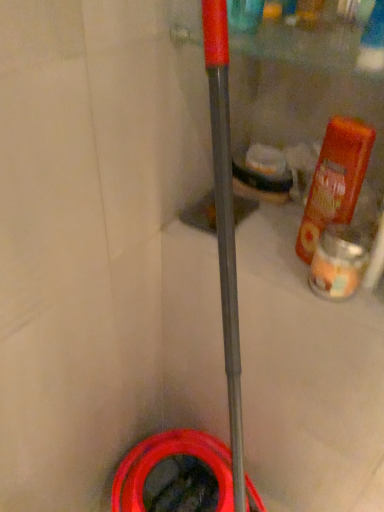
Question: Are rubber/matte garden hose at lower center and orange matte bottle at right far apart?

Choices:
 (A) yes
 (B) no

Answer: (B)

Question: From a real-world perspective, is rubber/matte garden hose at lower center physically above orange matte bottle at right?

Choices:
 (A) no
 (B) yes

Answer: (A)

Question: Can you confirm if rubber/matte garden hose at lower center is bigger than orange matte bottle at right?

Choices:
 (A) no
 (B) yes

Answer: (B)

Question: Can you see rubber/matte garden hose at lower center touching orange matte bottle at right?

Choices:
 (A) no
 (B) yes

Answer: (A)

Question: Does rubber/matte garden hose at lower center have a smaller size compared to orange matte bottle at right?

Choices:
 (A) no
 (B) yes

Answer: (A)

Question: From the image's perspective, is rubber/matte garden hose at lower center below orange matte bottle at right?

Choices:
 (A) no
 (B) yes

Answer: (B)

Question: Is translucent glass candle at right behind rubber/matte garden hose at lower center?

Choices:
 (A) no
 (B) yes

Answer: (A)

Question: Are translucent glass candle at right and rubber/matte garden hose at lower center beside each other?

Choices:
 (A) no
 (B) yes

Answer: (A)

Question: Can you confirm if translucent glass candle at right is thinner than rubber/matte garden hose at lower center?

Choices:
 (A) yes
 (B) no

Answer: (A)

Question: Does translucent glass candle at right appear on the right side of rubber/matte garden hose at lower center?

Choices:
 (A) yes
 (B) no

Answer: (A)

Question: Considering the relative sizes of translucent glass candle at right and rubber/matte garden hose at lower center in the image provided, is translucent glass candle at right taller than rubber/matte garden hose at lower center?

Choices:
 (A) yes
 (B) no

Answer: (B)

Question: Considering the relative positions of translucent glass candle at right and rubber/matte garden hose at lower center in the image provided, is translucent glass candle at right in front of rubber/matte garden hose at lower center?

Choices:
 (A) yes
 (B) no

Answer: (A)

Question: Does orange matte bottle at right have a larger size compared to rubber/matte garden hose at lower center?

Choices:
 (A) no
 (B) yes

Answer: (A)